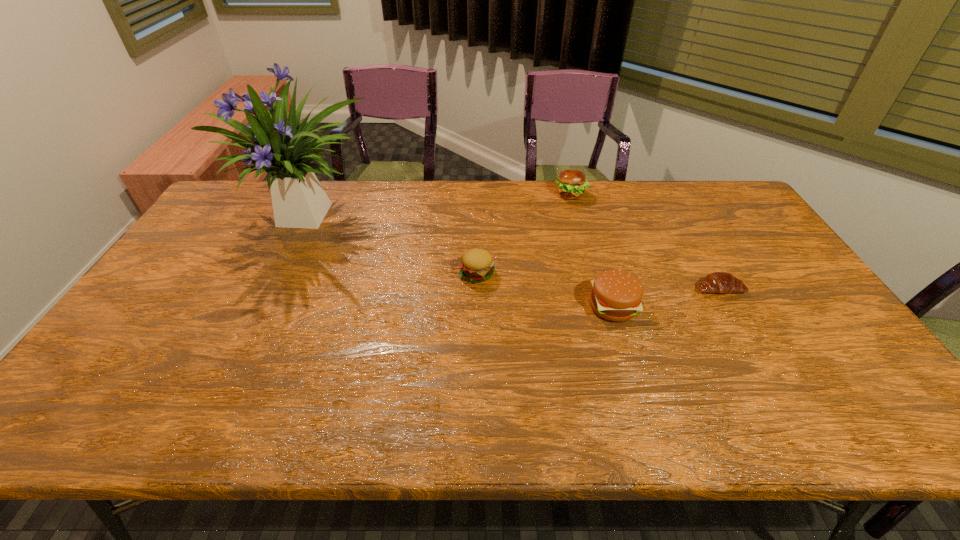
I want to click on flower arrangement, so click(x=299, y=201).

This screenshot has width=960, height=540. Identify the location of the tallest object. (299, 201).

This screenshot has height=540, width=960. I want to click on the farthest hamburger, so click(571, 184).

The image size is (960, 540). I want to click on the nearest hamburger, so click(x=616, y=295).

In order to click on the fourth object from right to left in this screenshot , I will do `click(477, 265)`.

Image resolution: width=960 pixels, height=540 pixels. Find the location of `the second nearest hamburger`. the second nearest hamburger is located at coordinates pos(477,265).

Identify the location of the shortest object. Image resolution: width=960 pixels, height=540 pixels. (718, 282).

Find the location of `the rightmost object`. the rightmost object is located at coordinates (718, 282).

Where is `vacant position located on the front of the flower arrangement`? The width and height of the screenshot is (960, 540). vacant position located on the front of the flower arrangement is located at coordinates (247, 347).

Where is `blank area located on the front of the farthest hamburger`? This screenshot has width=960, height=540. blank area located on the front of the farthest hamburger is located at coordinates (594, 281).